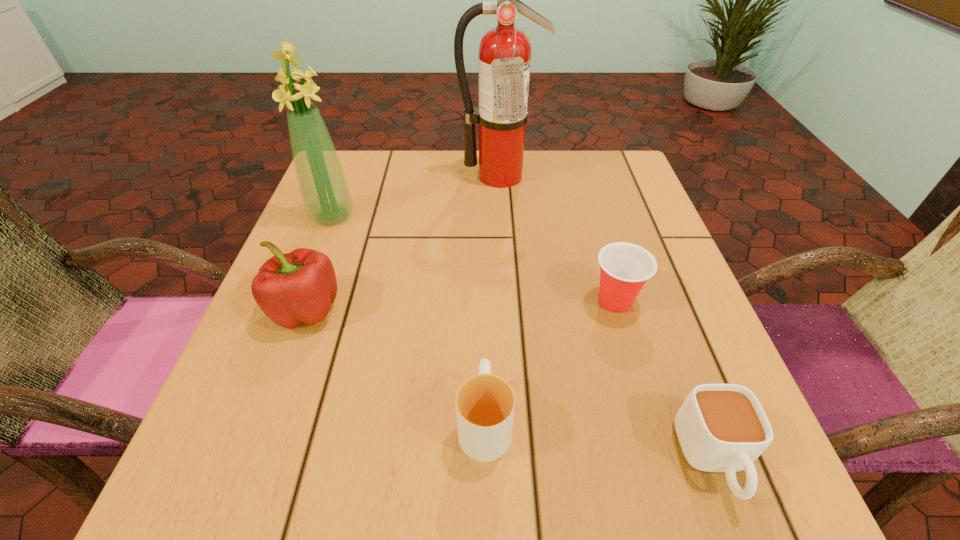
This screenshot has width=960, height=540. I want to click on fire extinguisher, so click(x=505, y=51).

Where is `the tallest object`? Image resolution: width=960 pixels, height=540 pixels. the tallest object is located at coordinates (505, 51).

Where is `bouquet`? The image size is (960, 540). bouquet is located at coordinates (324, 189).

Locate an element on the screen. This screenshot has height=540, width=960. the fifth nearest object is located at coordinates (324, 189).

I want to click on the third tallest object, so click(x=293, y=288).

Where is `the farthest cup`? the farthest cup is located at coordinates (624, 267).

In order to click on the leftmost cup in this screenshot , I will do `click(485, 403)`.

Locate an element on the screen. The image size is (960, 540). vacant point located on the nozzle side of the fire extinguisher is located at coordinates (501, 217).

The width and height of the screenshot is (960, 540). Find the location of `free space located 0.290m on the front-facing side of the fifth shortest object`. free space located 0.290m on the front-facing side of the fifth shortest object is located at coordinates (284, 341).

Where is `vacant point located 0.390m on the right of the bell pepper`? vacant point located 0.390m on the right of the bell pepper is located at coordinates (563, 309).